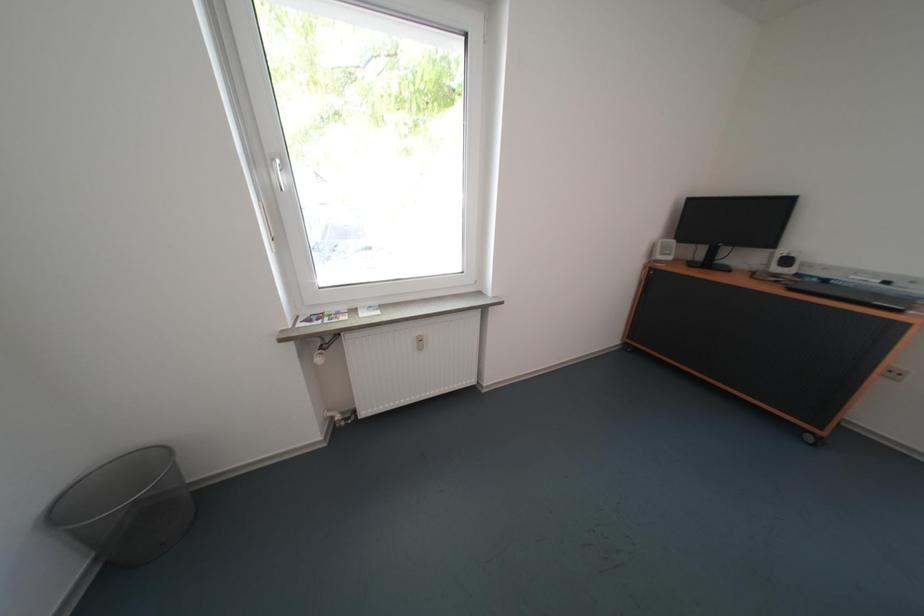
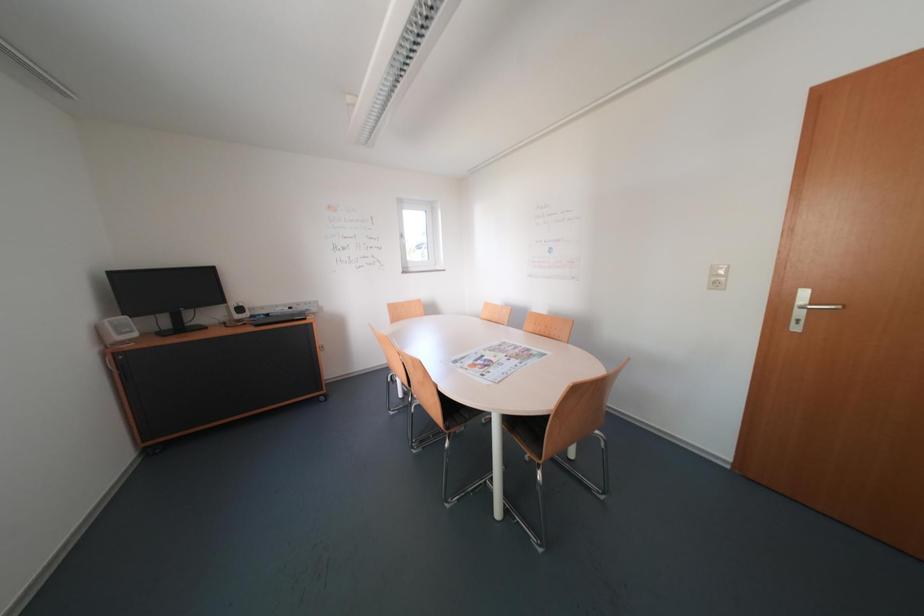
Question: The camera is either moving clockwise (left) or counter-clockwise (right) around the object. The first image is from the beginning of the video and the second image is from the end. Is the camera moving left or right when shooting the video?

Choices:
 (A) Left
 (B) Right

Answer: (A)